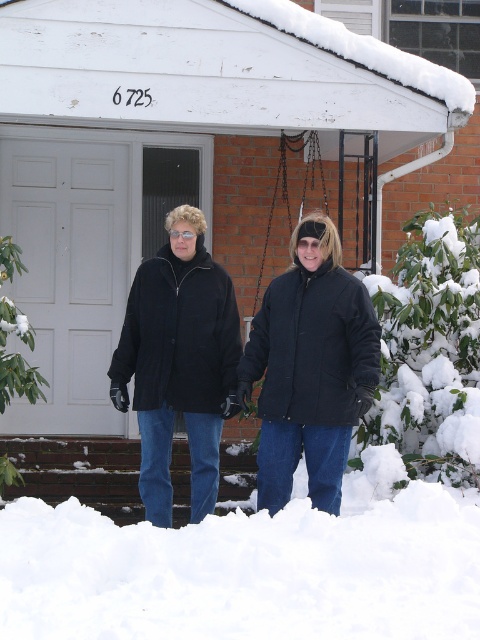
You are trying to decide which jacket to wear for a cold winter day. You see two jackets in the image, a matte black jacket at center and a black matte jacket at center. Which one is thinner?

The matte black jacket at center is thinner than the black matte jacket at center according to the description.